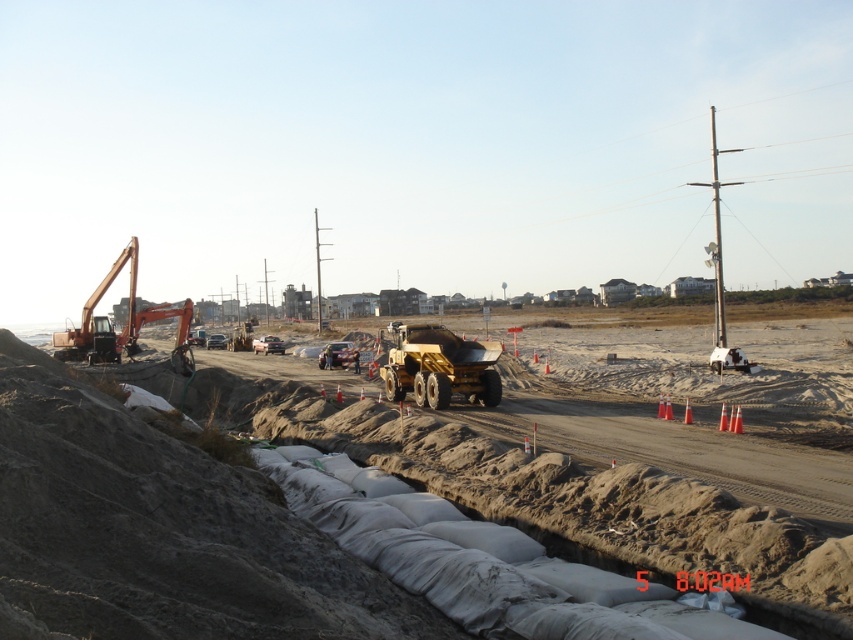
Question: Considering the relative positions of matte yellow truck at center and yellow metallic dump truck at center in the image provided, where is matte yellow truck at center located with respect to yellow metallic dump truck at center?

Choices:
 (A) left
 (B) right

Answer: (A)

Question: Can you confirm if matte yellow truck at center is positioned to the left of yellow metallic dump truck at center?

Choices:
 (A) yes
 (B) no

Answer: (A)

Question: Considering the real-world distances, which object is closest to the yellow metallic dump truck at center?

Choices:
 (A) orange metallic excavator at left
 (B) matte yellow truck at center

Answer: (B)

Question: Which point is farther from the camera taking this photo?

Choices:
 (A) (492, 353)
 (B) (119, 410)
 (C) (108, 284)

Answer: (C)

Question: Which object is farther from the camera taking this photo?

Choices:
 (A) matte yellow truck at center
 (B) yellow metallic dump truck at center
 (C) orange metallic excavator at left

Answer: (C)

Question: Is yellow metallic dump truck at center further to camera compared to orange metallic excavator at left?

Choices:
 (A) yes
 (B) no

Answer: (B)